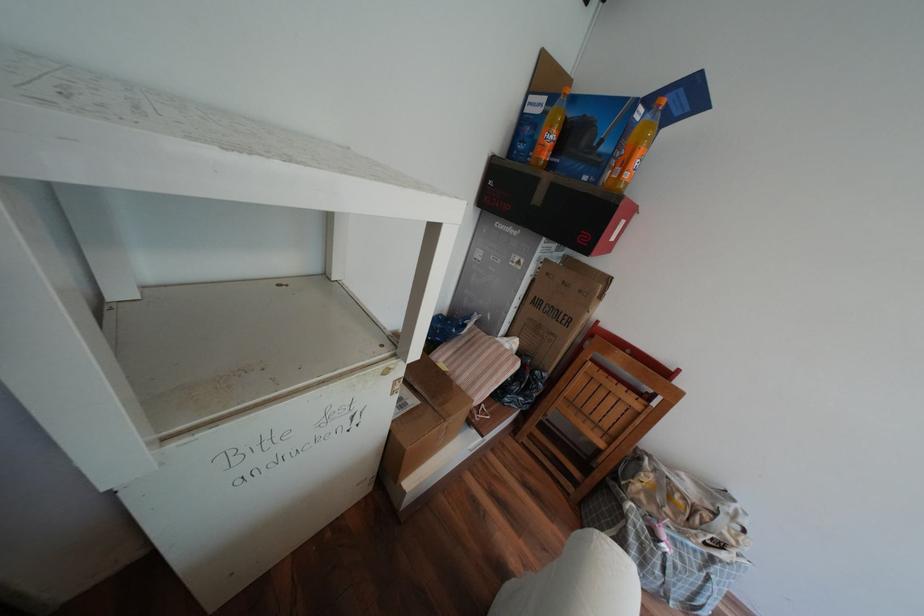
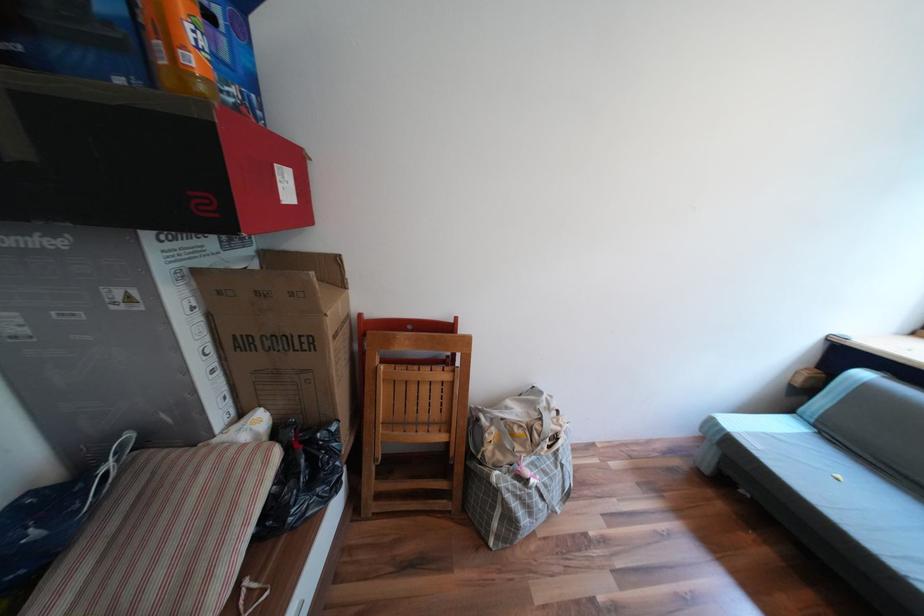
The point at (637,176) is marked in the first image. Where is the corresponding point in the second image?

(201, 61)